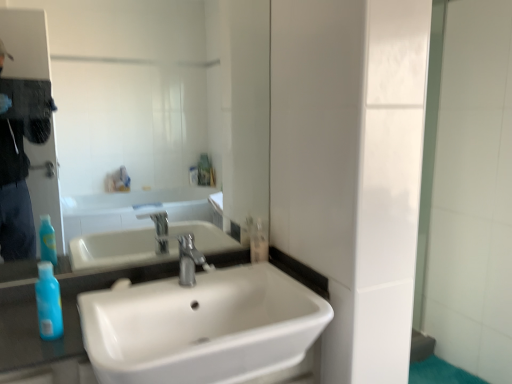
The image size is (512, 384). Identify the location of vacant space to the left of silver metallic faucet at center. (136, 289).